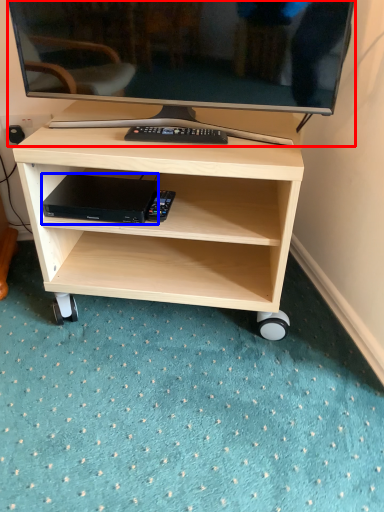
Question: Which object is closer to the camera taking this photo, television (highlighted by a red box) or computer (highlighted by a blue box)?

Choices:
 (A) television
 (B) computer

Answer: (A)